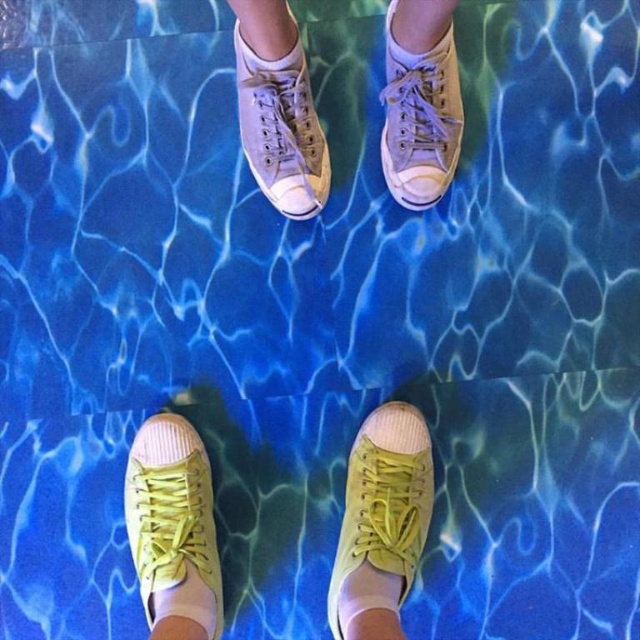
In the scene shown: You are designing a display for a sneaker store and need to arrange the matte yellow canvas shoe at lower left and the light gray canvas shoe at upper center. Since the display shelf has limited width, which shoe should you place first to ensure both fit properly?

The light gray canvas shoe at upper center should be placed first because its width is smaller than the matte yellow canvas shoe at lower left, allowing both to fit on the shelf with limited space.

You are trying to determine which item is higher up in the image. You see the light beige canvas shoes at center and the white cotton sock at lower center. Which one is positioned higher?

The light beige canvas shoes at center is taller than the white cotton sock at lower center, so the light beige canvas shoes at center is positioned higher.

You are designing a display for a sneaker exhibition and need to place both the light beige canvas shoes at center and the matte yellow canvas shoe at lower left on a shelf. The shelf has limited space, and you want to ensure that the wider shoe is placed first to optimize space. Which shoe should you place first?

The light beige canvas shoes at center might be wider than matte yellow canvas shoe at lower left, so you should place the light beige canvas shoes at center first to accommodate their width.